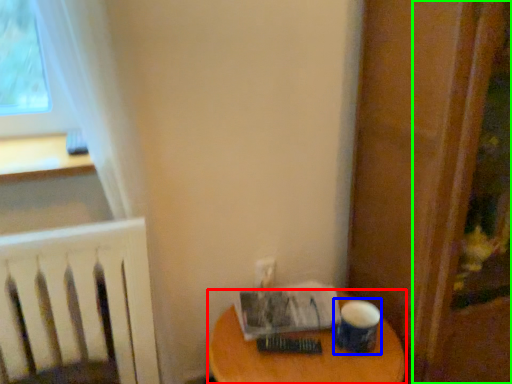
Question: Which object is positioned closest to table (highlighted by a red box)? Select from paper cup (highlighted by a blue box) and screen door (highlighted by a green box).

Choices:
 (A) paper cup
 (B) screen door

Answer: (A)